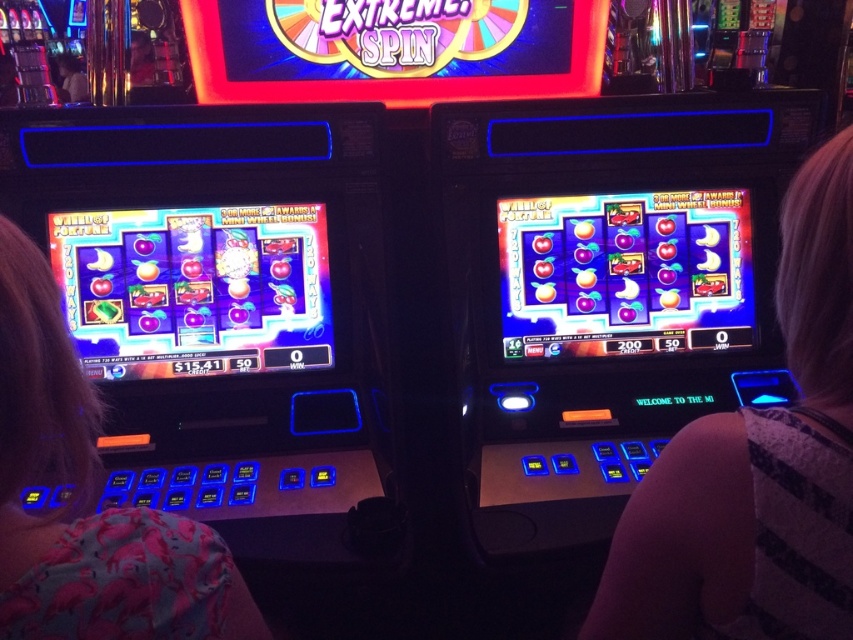
Can you confirm if striped fabric shoulder at right is positioned below pink fabric shirt at left?

Incorrect, striped fabric shoulder at right is not positioned below pink fabric shirt at left.

Between striped fabric shoulder at right and pink fabric shirt at left, which one appears on the right side from the viewer's perspective?

From the viewer's perspective, striped fabric shoulder at right appears more on the right side.

The width and height of the screenshot is (853, 640). What are the coordinates of `striped fabric shoulder at right` in the screenshot? It's located at (757, 468).